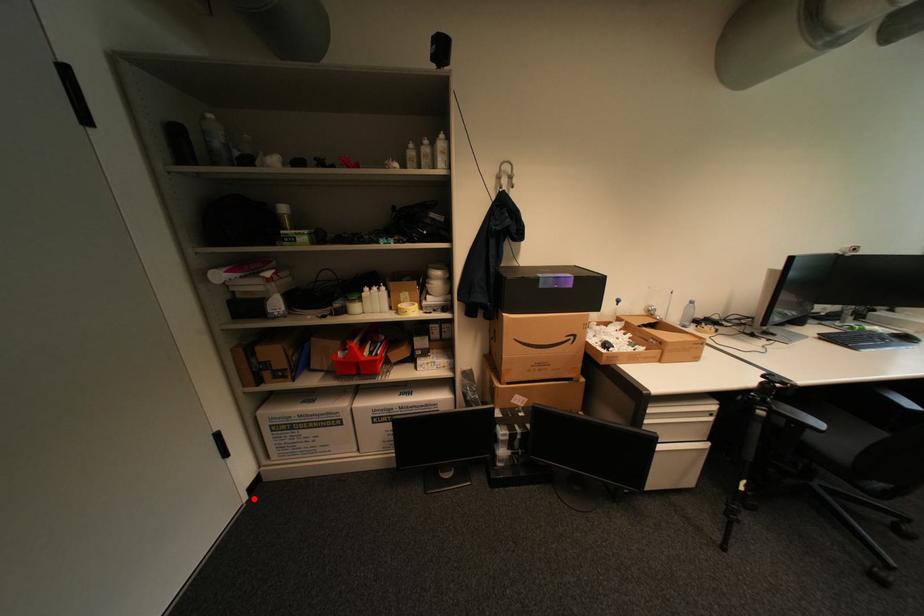
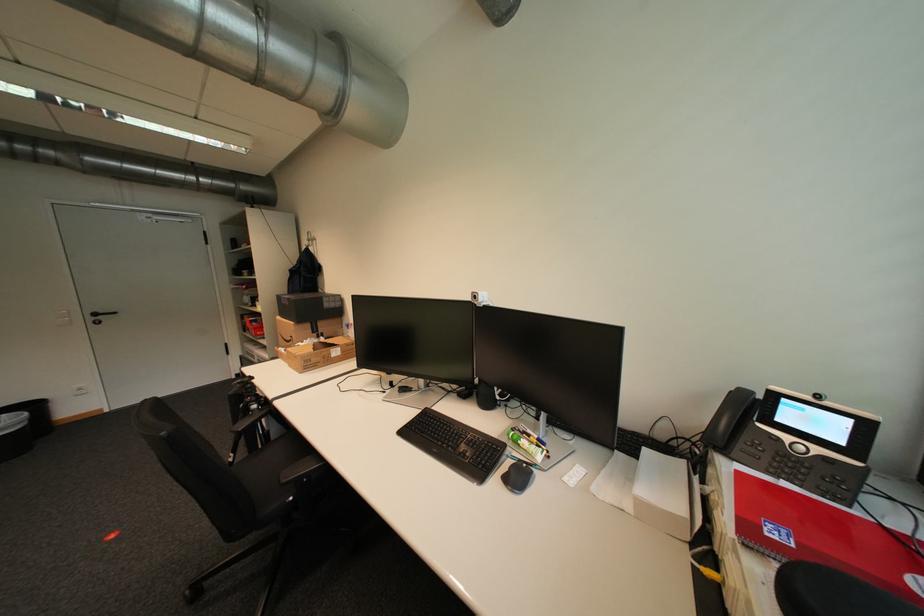
Question: A red point is marked in image1. In image2, is the corresponding 3D point closer to the camera or farther? Reply with the corresponding letter.

Choices:
 (A) The corresponding 3D point is closer.
 (B) The corresponding 3D point is farther.

Answer: (B)